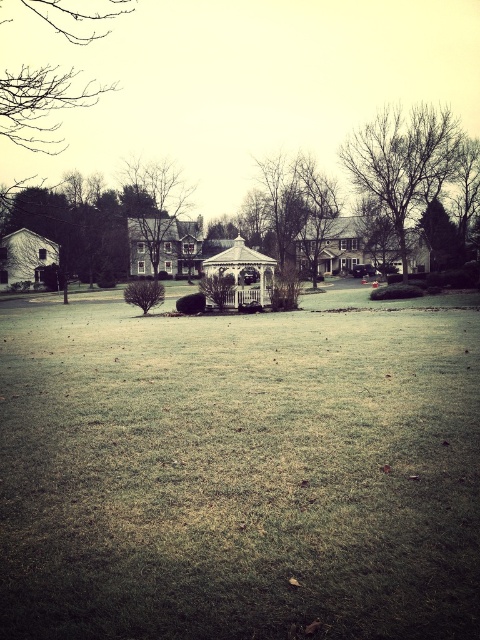
You are a painter setting up your easel to capture the suburban scene. You want to focus on the bare branches at upper right and the brown wood tree at upper center. Which object should you position closer to the edge of your canvas to emphasize their width difference?

The bare branches at upper right should be positioned closer to the edge of the canvas because their width surpasses that of the brown wood tree at upper center, allowing the viewer to notice the contrast in their sizes more effectively.

You are a bird looking for a nesting spot. You see the brown wood tree at upper center and the white wooden gazebo at center. Which location would provide a higher nesting spot?

The brown wood tree at upper center has a greater height compared to the white wooden gazebo at center, so it would provide a higher nesting spot.